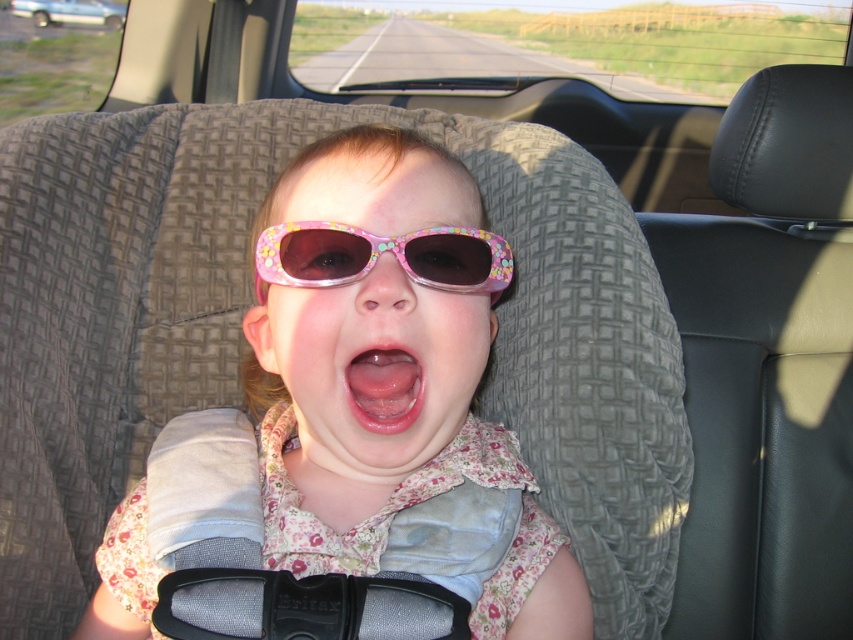
You are a photographer trying to capture the pink floral fabric at center in the image. Based on the coordinates provided, where exactly should you focus your camera lens to ensure the fabric is in the center of the photo?

The pink floral fabric at center is located at coordinates point (352,416), so you should focus your camera lens at those exact coordinates to center the fabric in the photo.

You are a parent checking if the pink floral plastic goggles at center and pink glossy lips at center are positioned safely. Based on their sizes, which one is wider?

The pink floral plastic goggles at center might be wider than the pink glossy lips at center according to the description.

Consider the image. A child is sitting in a car seat wearing a floral shirt. The child has on pink sunglasses with a polka dot design. The scene also includes a harness with a black buckle. The background shows a rural road with green fields. You are a safety inspector checking if the child can see the road clearly through the sunglasses. Based on the distance between the pink floral plastic goggles at center and the pink glossy lips at center, can the child see the road clearly?

The pink floral plastic goggles at center are only 3.38 inches away from the pink glossy lips at center, which means the goggles are positioned too close to the child mouth, possibly obstructing their view. Therefore, the child may not be able to see the road clearly through the sunglasses.